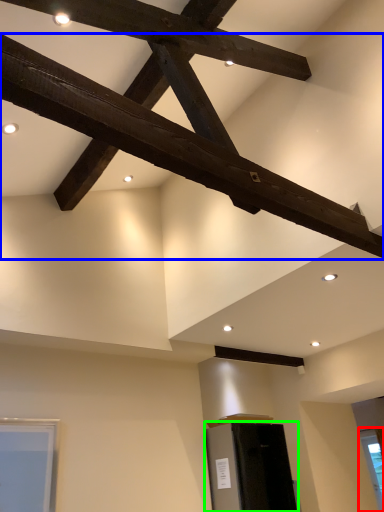
Question: Which object is the farthest from window (highlighted by a red box)? Choose among these: beam (highlighted by a blue box) or furniture (highlighted by a green box).

Choices:
 (A) beam
 (B) furniture

Answer: (A)